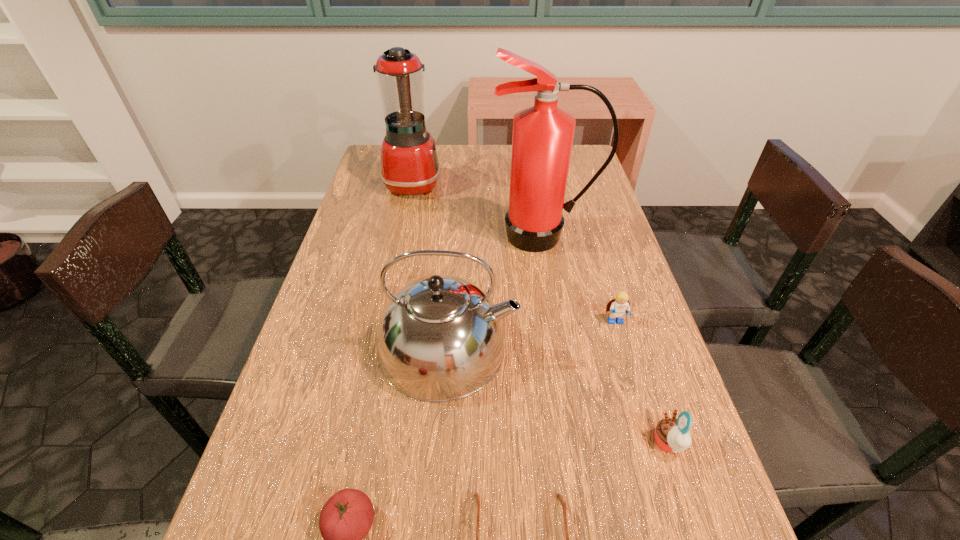
At what (x,y) coordinates should I click in order to perform the action: click on the tallest object. Please return your answer as a coordinate pair (x, y). This screenshot has height=540, width=960. Looking at the image, I should click on (542, 138).

This screenshot has width=960, height=540. What are the coordinates of `fire extinguisher` in the screenshot? It's located at 542,138.

The image size is (960, 540). I want to click on the sixth shortest object, so click(x=410, y=166).

Identify the location of the farthest object. (410, 166).

Find the location of a particular element. Image resolution: width=960 pixels, height=540 pixels. the fifth shortest object is located at coordinates (440, 338).

Locate an element on the screen. Lego is located at coordinates (619, 307).

The height and width of the screenshot is (540, 960). I want to click on the fifth farthest object, so click(x=672, y=435).

At what (x,y) coordinates should I click in order to perform the action: click on free spot located at the spray nozzle of the fire extinguisher. Please return your answer as a coordinate pair (x, y). This screenshot has height=540, width=960. Looking at the image, I should click on (560, 326).

The height and width of the screenshot is (540, 960). In order to click on free region located 0.170m on the controls of the second tallest object in this screenshot , I will do `click(493, 183)`.

This screenshot has width=960, height=540. What are the coordinates of `vacant space located from the spout of the kettle` in the screenshot? It's located at (550, 347).